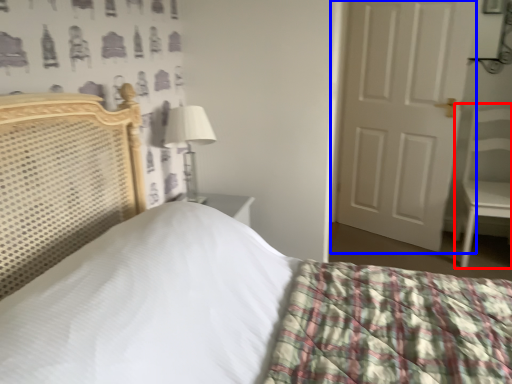
Question: Among these objects, which one is farthest to the camera, armchair (highlighted by a red box) or door (highlighted by a blue box)?

Choices:
 (A) armchair
 (B) door

Answer: (B)